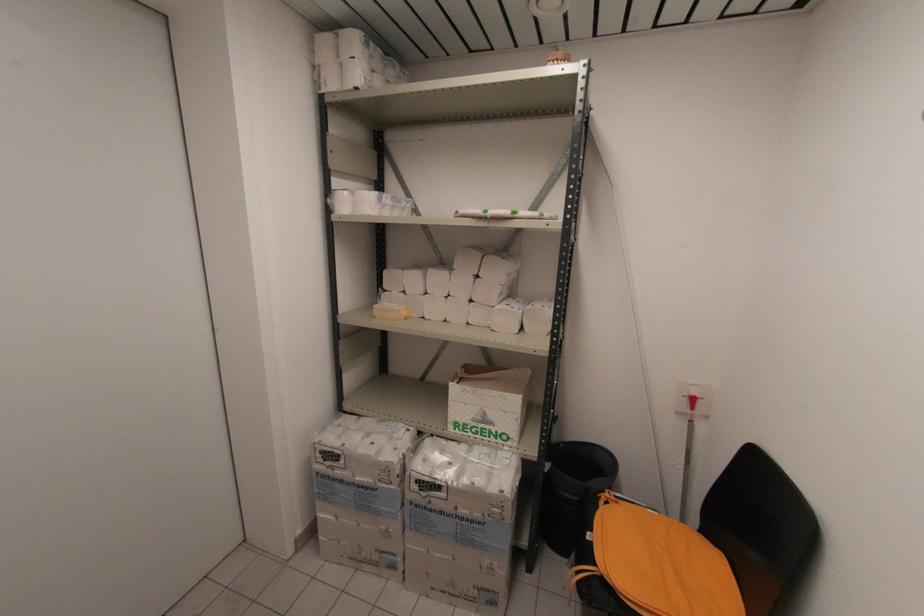
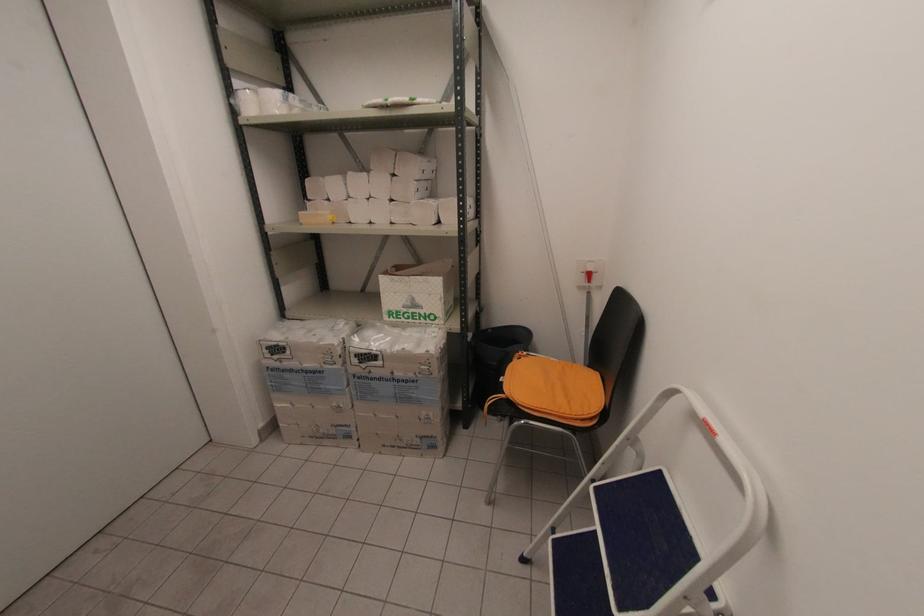
The images are taken continuously from a first-person perspective. In which direction are you moving?

The cameraman moved toward right, backward.